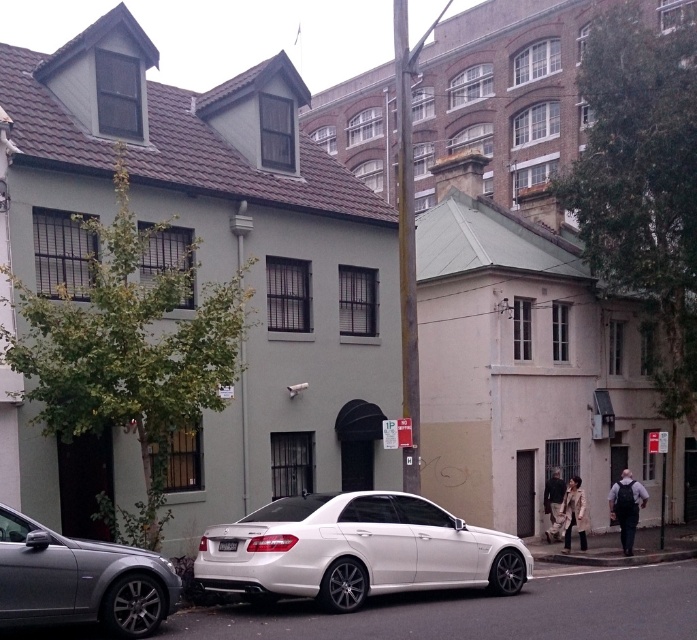
In the scene shown: Is white metallic car at center further to the viewer compared to silver metallic sedan at lower left?

Yes, it is behind silver metallic sedan at lower left.

What do you see at coordinates (355, 550) in the screenshot? I see `white metallic car at center` at bounding box center [355, 550].

Locate an element on the screen. The width and height of the screenshot is (697, 640). white metallic car at center is located at coordinates point(355,550).

Does white metallic car at center appear on the left side of gray concrete curb at lower center?

Indeed, white metallic car at center is positioned on the left side of gray concrete curb at lower center.

Can you confirm if white metallic car at center is taller than gray concrete curb at lower center?

Yes, white metallic car at center is taller than gray concrete curb at lower center.

Identify the location of white metallic car at center. [x=355, y=550].

Who is more forward, (53, 548) or (636, 563)?

Point (53, 548)

Does silver metallic sedan at lower left have a smaller size compared to gray concrete curb at lower center?

Incorrect, silver metallic sedan at lower left is not smaller in size than gray concrete curb at lower center.

You are a GUI agent. You are given a task and a screenshot of the screen. Output one action in this format:
    pyautogui.click(x=<x>, y=<y>)
    Task: Click on the silver metallic sedan at lower left
    Image resolution: width=697 pixels, height=640 pixels.
    Given the screenshot: What is the action you would take?
    pyautogui.click(x=79, y=580)